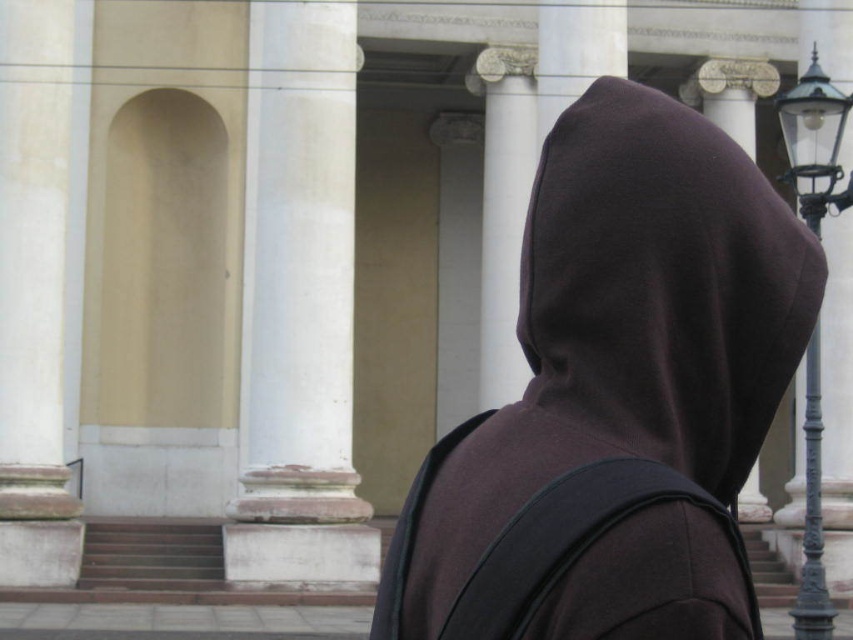
You are standing at the center of the image and want to walk towards the white marble column at center. Which direction should you move?

Since the white marble column at center is located at point 0.483 on the x axis and 0.352 on the y axis, you should move slightly to the right and forward to reach it.

You are a photographer trying to capture a shot of the white marble column at center and the brown fleece hood at center. From your current position, which object is positioned more to the right?

The brown fleece hood at center is positioned more to the right than the white marble column at center.

You are standing in front of a classical building with columns and a streetlamp nearby. There is a specific point marked at coordinates point (746, 240). If you want to reach that point quickly, should you walk towards the classical building or the streetlamp?

The point (746, 240) is 5.73 meters away from camera, so you should walk towards the classical building because it is closer to the point than the streetlamp.